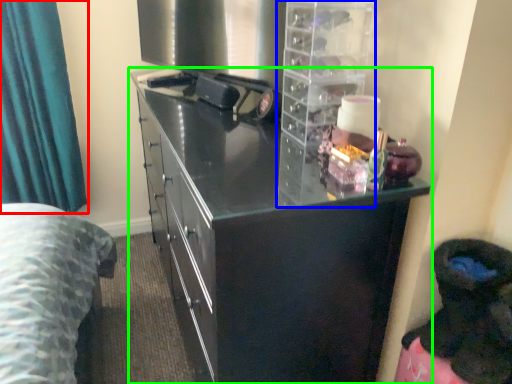
Question: Which object is positioned closest to curtain (highlighted by a red box)? Select from cabinet (highlighted by a blue box) and cupboard (highlighted by a green box).

Choices:
 (A) cabinet
 (B) cupboard

Answer: (B)